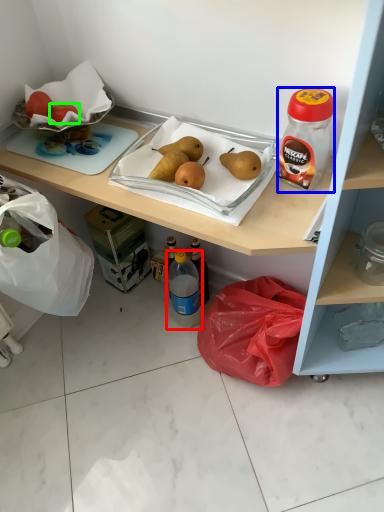
Question: Which is farther away from bottle (highlighted by a red box)? bottle (highlighted by a blue box) or fruit (highlighted by a green box)?

Choices:
 (A) bottle
 (B) fruit

Answer: (B)